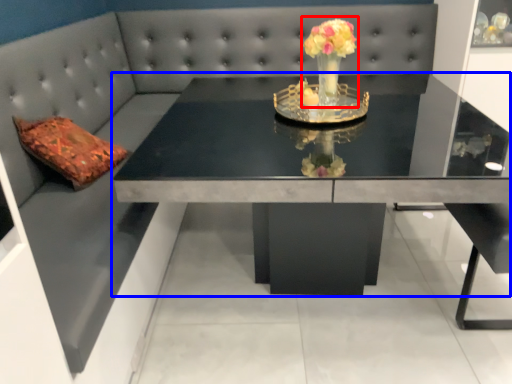
Question: Among these objects, which one is farthest to the camera, floral arrangement (highlighted by a red box) or table (highlighted by a blue box)?

Choices:
 (A) floral arrangement
 (B) table

Answer: (A)